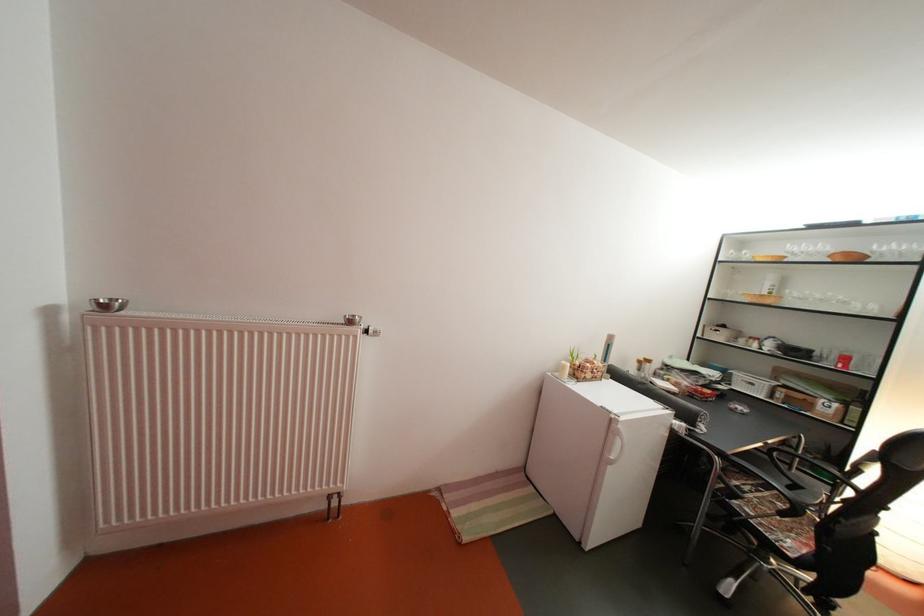
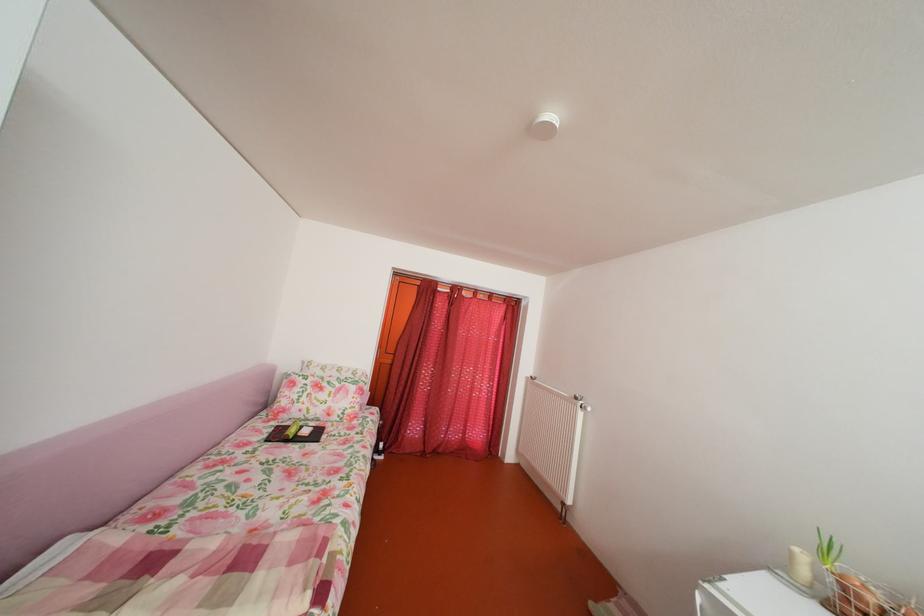
In the second image, find the point that corresponds to point 575,373 in the first image.

(803, 561)